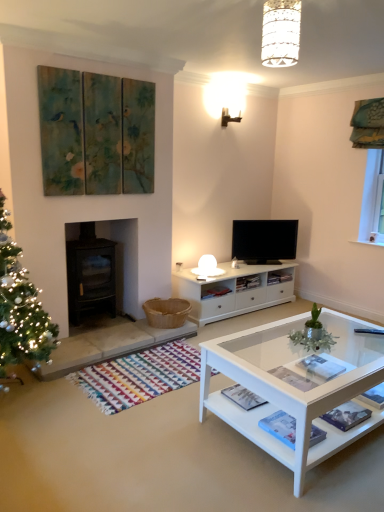
Question: Could black glass fireplace at left be considered to be inside flat screen tv at center?

Choices:
 (A) yes
 (B) no

Answer: (B)

Question: Considering the relative positions of flat screen tv at center and black glass fireplace at left in the image provided, is flat screen tv at center to the right of black glass fireplace at left from the viewer's perspective?

Choices:
 (A) yes
 (B) no

Answer: (A)

Question: Considering the relative positions of flat screen tv at center and black glass fireplace at left in the image provided, is flat screen tv at center in front of black glass fireplace at left?

Choices:
 (A) yes
 (B) no

Answer: (B)

Question: Considering the relative sizes of flat screen tv at center and black glass fireplace at left in the image provided, is flat screen tv at center wider than black glass fireplace at left?

Choices:
 (A) no
 (B) yes

Answer: (A)

Question: Is flat screen tv at center looking in the opposite direction of black glass fireplace at left?

Choices:
 (A) yes
 (B) no

Answer: (B)

Question: From a real-world perspective, is white glass coffee table at lower right above or below white textured lampshade at upper center?

Choices:
 (A) above
 (B) below

Answer: (B)

Question: Is white glass coffee table at lower right wider or thinner than white textured lampshade at upper center?

Choices:
 (A) thin
 (B) wide

Answer: (B)

Question: Considering the positions of white glass coffee table at lower right and white textured lampshade at upper center in the image, is white glass coffee table at lower right bigger or smaller than white textured lampshade at upper center?

Choices:
 (A) small
 (B) big

Answer: (B)

Question: Is white glass coffee table at lower right in front of or behind white textured lampshade at upper center in the image?

Choices:
 (A) front
 (B) behind

Answer: (A)

Question: Is point (294, 220) closer or farther from the camera than point (132, 223)?

Choices:
 (A) closer
 (B) farther

Answer: (B)

Question: Would you say flat screen tv at center is to the left or to the right of black glass fireplace at left in the picture?

Choices:
 (A) right
 (B) left

Answer: (A)

Question: Looking at the image, does flat screen tv at center seem bigger or smaller compared to black glass fireplace at left?

Choices:
 (A) small
 (B) big

Answer: (A)

Question: Considering their positions, is flat screen tv at center located in front of or behind black glass fireplace at left?

Choices:
 (A) behind
 (B) front

Answer: (A)

Question: From their relative heights in the image, would you say white glass coffee table at lower right is taller or shorter than black glass fireplace at left?

Choices:
 (A) tall
 (B) short

Answer: (B)

Question: From the image's perspective, is white glass coffee table at lower right positioned above or below black glass fireplace at left?

Choices:
 (A) below
 (B) above

Answer: (A)